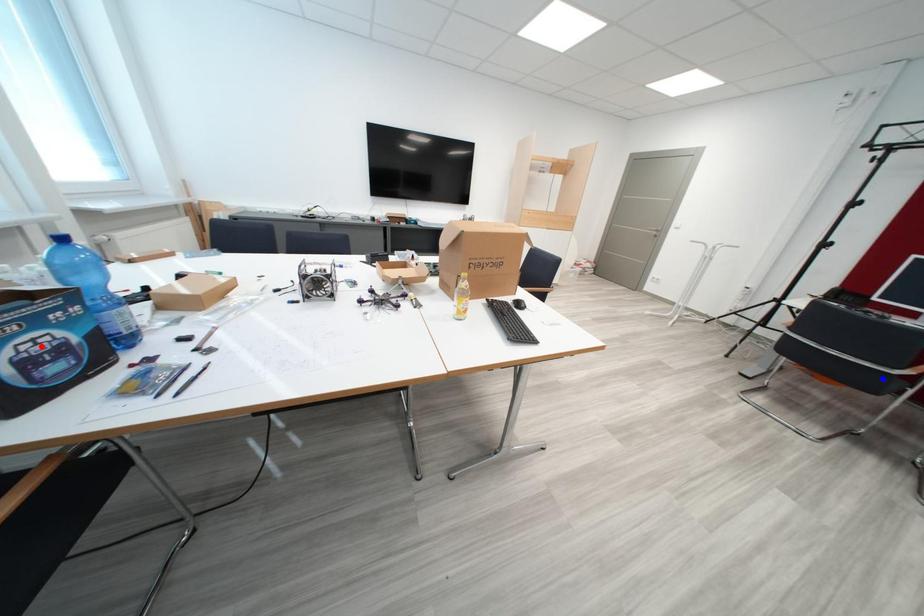
Question: Two points are marked on the image. Which point is closer to the camera?

Choices:
 (A) Blue point is closer.
 (B) Red point is closer.

Answer: (B)